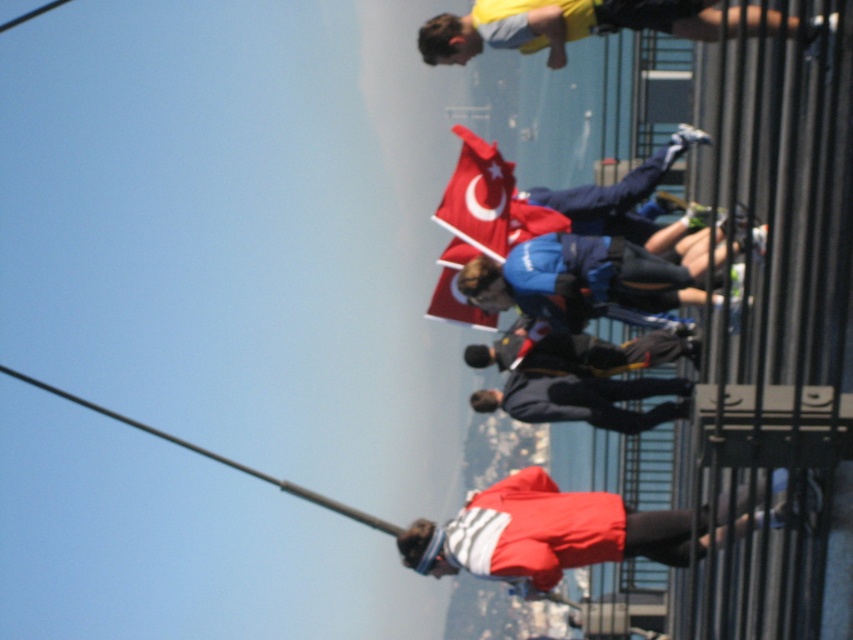
You are a photographer taking a picture of the yellow fabric shirt at upper center and the red fabric flag at center. Which object should you focus on first if you want to capture both in the same frame?

The yellow fabric shirt at upper center is above the red fabric flag at center, so you should focus on the yellow fabric shirt at upper center first to ensure both are in the frame.